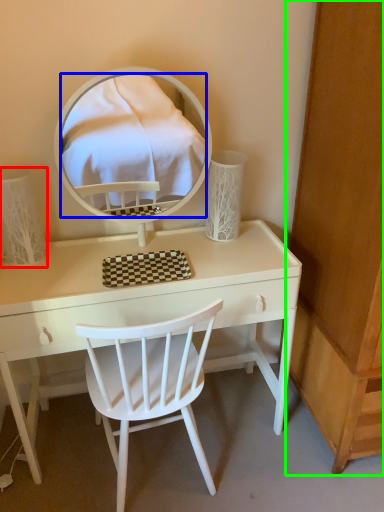
Question: Which object is the closest to the table lamp (highlighted by a red box)? Choose among these: mirror (highlighted by a blue box) or dresser (highlighted by a green box).

Choices:
 (A) mirror
 (B) dresser

Answer: (B)